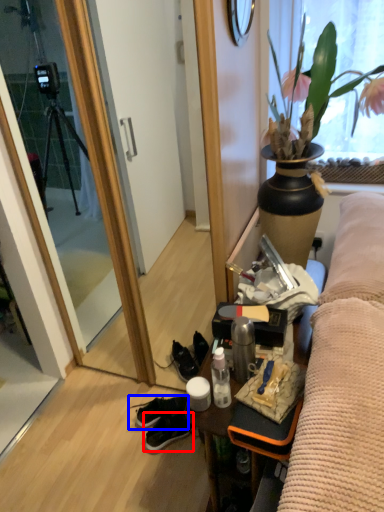
Question: Which of the following is the closest to the observer, sneakers (highlighted by a red box) or footwear (highlighted by a blue box)?

Choices:
 (A) sneakers
 (B) footwear

Answer: (A)